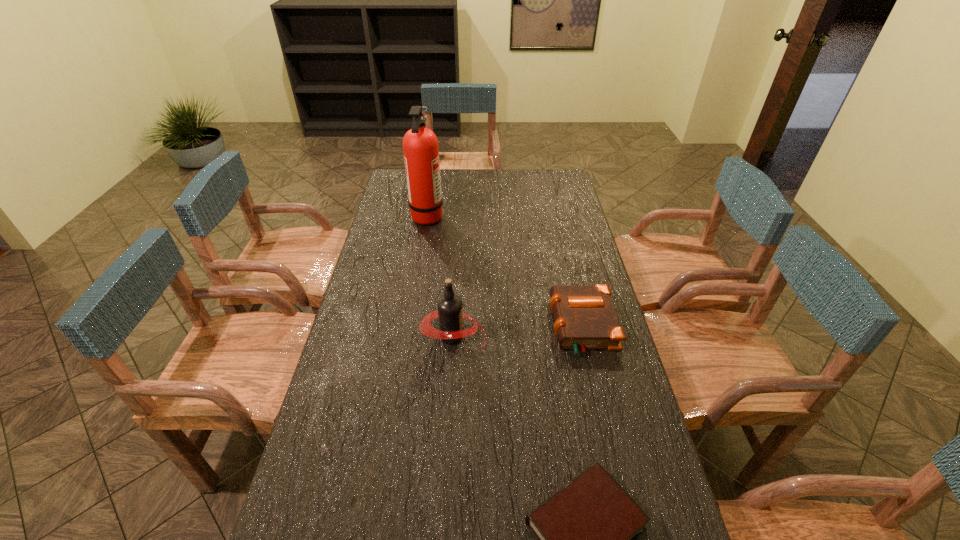
The image size is (960, 540). In order to click on object that is positioned at the right edge in this screenshot , I will do `click(585, 318)`.

Locate an element on the screen. free space at the far edge of the desktop is located at coordinates click(532, 182).

Identify the location of free location at the left edge of the desktop. The image size is (960, 540). (361, 338).

What are the coordinates of `vacant region at the right edge of the desktop` in the screenshot? It's located at (564, 247).

Find the location of a particular element. blank space at the far right corner of the desktop is located at coordinates (562, 171).

Where is `vacant space that's between the farther Bible and the tallest object`? vacant space that's between the farther Bible and the tallest object is located at coordinates (505, 271).

At what (x,y) coordinates should I click in order to perform the action: click on empty location between the tallest object and the root beer. Please return your answer as a coordinate pair (x, y). Looking at the image, I should click on (440, 276).

Where is `free space that is in between the tallest object and the second tallest object`? The width and height of the screenshot is (960, 540). free space that is in between the tallest object and the second tallest object is located at coordinates (440, 276).

Find the location of a particular element. The height and width of the screenshot is (540, 960). vacant region between the farther Bible and the third shortest object is located at coordinates (517, 331).

At what (x,y) coordinates should I click in order to perform the action: click on free space between the second tallest object and the farther Bible. Please return your answer as a coordinate pair (x, y). The width and height of the screenshot is (960, 540). Looking at the image, I should click on (517, 331).